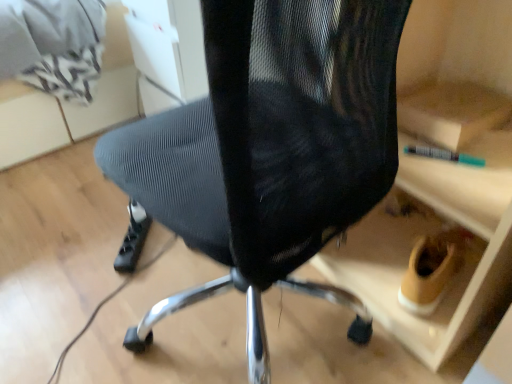
In order to face matte gray mesh chair at upper center, should I rotate leftwards or rightwards?

Turn left by 24.133 degrees to look at matte gray mesh chair at upper center.

This screenshot has width=512, height=384. I want to click on black plastic power strip at lower left, so click(x=133, y=239).

Describe the element at coordinates (133, 239) in the screenshot. I see `black plastic power strip at lower left` at that location.

I want to click on matte gray mesh chair at upper center, so click(69, 104).

Relative to black plastic power strip at lower left, is black mesh chair at center in front or behind?

In the image, black mesh chair at center appears in front of black plastic power strip at lower left.

In the scene shown: Looking at the image, does black mesh chair at center seem bigger or smaller compared to black plastic power strip at lower left?

Clearly, black mesh chair at center is larger in size than black plastic power strip at lower left.

Consider the image. From a real-world perspective, is black mesh chair at center positioned above or below black plastic power strip at lower left?

Clearly, from a real-world perspective, black mesh chair at center is above black plastic power strip at lower left.

Where is `chair that appears above the black plastic power strip at lower left (from the image's perspective)`? chair that appears above the black plastic power strip at lower left (from the image's perspective) is located at coordinates (270, 146).

How many degrees apart are the facing directions of matte gray mesh chair at upper center and black plastic power strip at lower left?

42.1 degrees separate the facing orientations of matte gray mesh chair at upper center and black plastic power strip at lower left.

From the image's perspective, is matte gray mesh chair at upper center on black plastic power strip at lower left?

Yes, from the image's perspective, matte gray mesh chair at upper center is above black plastic power strip at lower left.

Which is in front, point (120, 49) or point (126, 258)?

The point (126, 258) is in front.

Consider the image. Does matte gray mesh chair at upper center have a greater height compared to black plastic power strip at lower left?

Yes.

Considering the positions of points (1, 92) and (340, 52), is point (1, 92) farther from camera compared to point (340, 52)?

Yes, point (1, 92) is farther from viewer.

From a real-world perspective, between matte gray mesh chair at upper center and black mesh chair at center, who is vertically higher?

black mesh chair at center.

Looking at their sizes, would you say matte gray mesh chair at upper center is wider or thinner than black mesh chair at center?

Considering their sizes, matte gray mesh chair at upper center looks broader than black mesh chair at center.

From the image's perspective, does matte gray mesh chair at upper center appear lower than black mesh chair at center?

Actually, matte gray mesh chair at upper center appears above black mesh chair at center in the image.

Is black plastic power strip at lower left smaller than matte gray mesh chair at upper center?

Indeed, black plastic power strip at lower left has a smaller size compared to matte gray mesh chair at upper center.

Is point (135, 243) less distant than point (130, 57)?

Yes, it is in front of point (130, 57).

Can you confirm if black plastic power strip at lower left is shorter than matte gray mesh chair at upper center?

Yes.

Can you tell me how much black plastic power strip at lower left and black mesh chair at center differ in facing direction?

black plastic power strip at lower left and black mesh chair at center are facing 135 degrees away from each other.

Is black plastic power strip at lower left not near black mesh chair at center?

Actually, black plastic power strip at lower left and black mesh chair at center are a little close together.

Does black plastic power strip at lower left have a lesser height compared to black mesh chair at center?

Yes.

Based on the photo, is black mesh chair at center at the back of black plastic power strip at lower left?

No, black plastic power strip at lower left is not facing the opposite direction of black mesh chair at center.

Which of these two, black mesh chair at center or matte gray mesh chair at upper center, is thinner?

Thinner between the two is black mesh chair at center.

Is matte gray mesh chair at upper center a part of black mesh chair at center?

No, black mesh chair at center does not contain matte gray mesh chair at upper center.

Is black mesh chair at center further to camera compared to matte gray mesh chair at upper center?

No, it is in front of matte gray mesh chair at upper center.

This screenshot has height=384, width=512. Identify the location of shelf located behind the black mesh chair at center. (69, 104).

Where is `foot that appears behind the black mesh chair at center`? This screenshot has width=512, height=384. foot that appears behind the black mesh chair at center is located at coordinates (133, 239).

Find the location of a particular element. foot that appears below the matte gray mesh chair at upper center (from the image's perspective) is located at coordinates (133, 239).

Which object lies further to the anchor point black plastic power strip at lower left, matte gray mesh chair at upper center or black mesh chair at center?

Based on the image, black mesh chair at center appears to be further to black plastic power strip at lower left.

Looking at this image, considering their positions, is black plastic power strip at lower left positioned closer to matte gray mesh chair at upper center than black mesh chair at center?

black plastic power strip at lower left lies closer to matte gray mesh chair at upper center than the other object.

Considering their positions, is black mesh chair at center positioned closer to matte gray mesh chair at upper center than black plastic power strip at lower left?

black plastic power strip at lower left is closer to matte gray mesh chair at upper center.

Based on the photo, when comparing their distances from black mesh chair at center, does matte gray mesh chair at upper center or black plastic power strip at lower left seem further?

matte gray mesh chair at upper center is positioned further to the anchor black mesh chair at center.

From the image, which object appears to be nearer to black plastic power strip at lower left, black mesh chair at center or matte gray mesh chair at upper center?

Among the two, matte gray mesh chair at upper center is located nearer to black plastic power strip at lower left.

Estimate the real-world distances between objects in this image. Which object is further from black mesh chair at center, black plastic power strip at lower left or matte gray mesh chair at upper center?

matte gray mesh chair at upper center is further to black mesh chair at center.

Image resolution: width=512 pixels, height=384 pixels. Identify the location of foot located between black mesh chair at center and matte gray mesh chair at upper center in the depth direction. (133, 239).